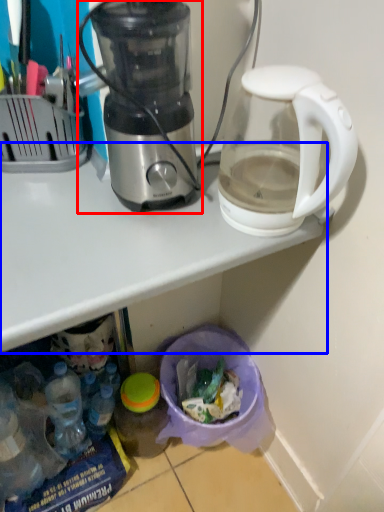
Question: Which object is further to the camera taking this photo, blender (highlighted by a red box) or table (highlighted by a blue box)?

Choices:
 (A) blender
 (B) table

Answer: (A)